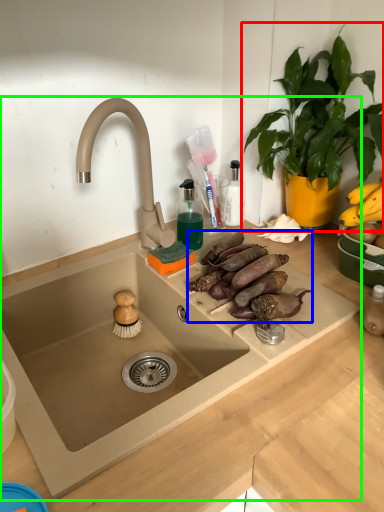
Question: Based on their relative distances, which object is nearer to houseplant (highlighted by a red box)? Choose from food (highlighted by a blue box) and sink (highlighted by a green box).

Choices:
 (A) food
 (B) sink

Answer: (A)